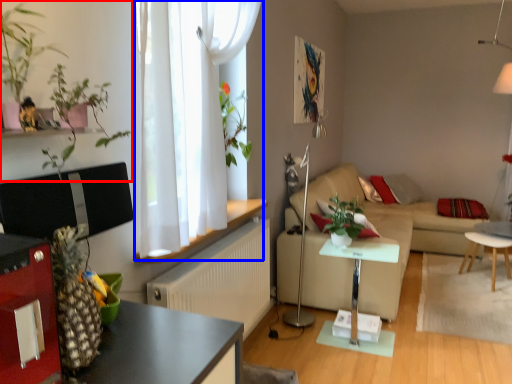
Question: Which object appears closest to the camera in this image, plant (highlighted by a red box) or curtain (highlighted by a blue box)?

Choices:
 (A) plant
 (B) curtain

Answer: (A)